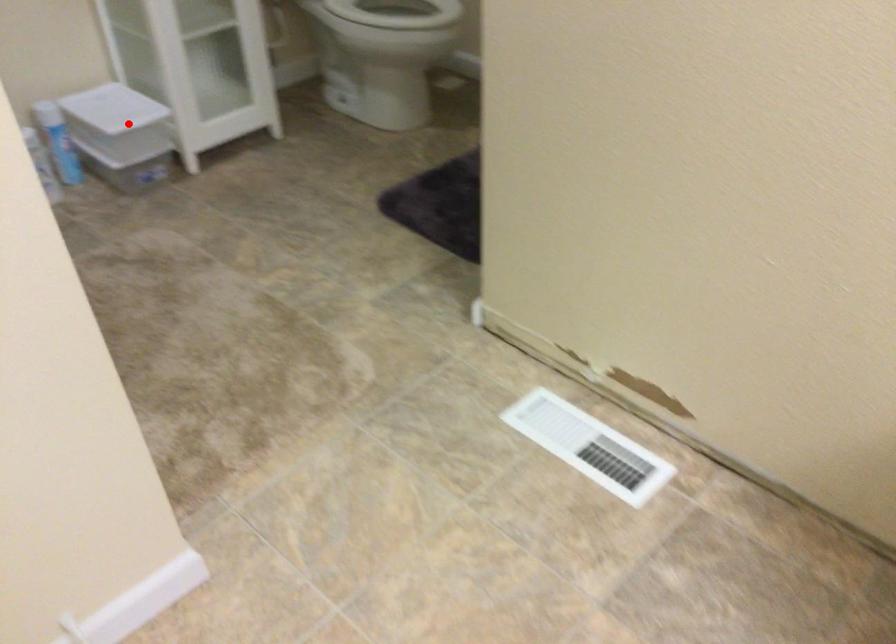
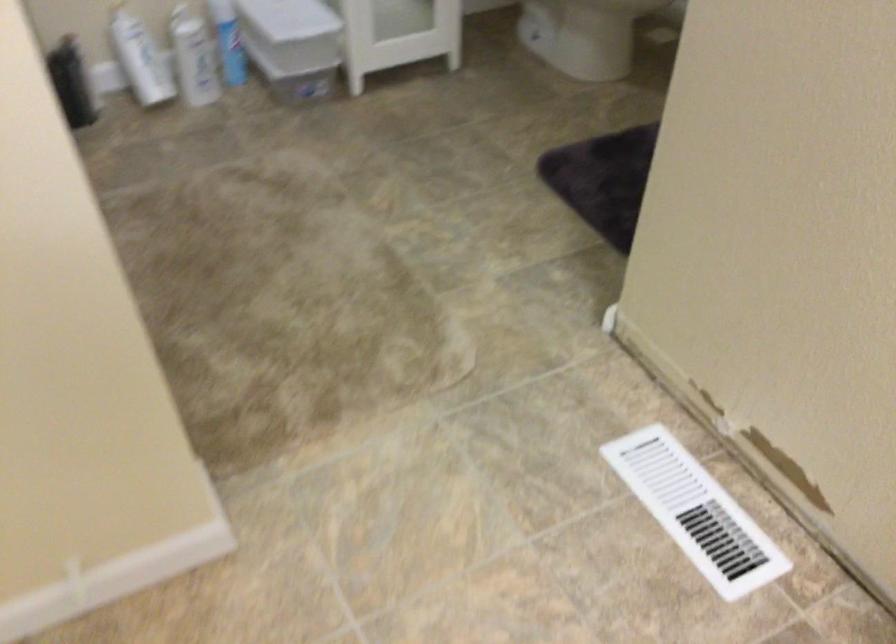
In the second image, find the point that corresponds to the highlighted location in the first image.

(293, 32)